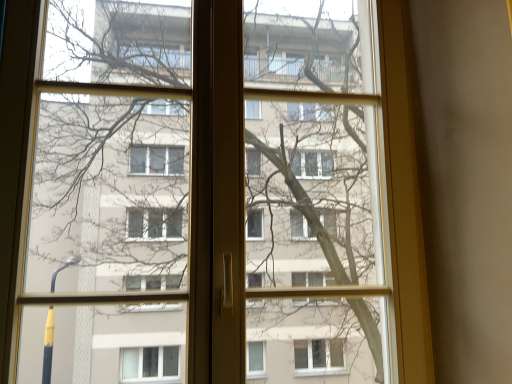
Find the location of `transparent glass window at center`. transparent glass window at center is located at coordinates (205, 197).

Measure the distance between point (339,35) and camera.

A distance of 6.53 feet exists between point (339,35) and camera.

This screenshot has height=384, width=512. What do you see at coordinates (205, 197) in the screenshot?
I see `transparent glass window at center` at bounding box center [205, 197].

Locate an element on the screen. The height and width of the screenshot is (384, 512). transparent glass window at center is located at coordinates (205, 197).